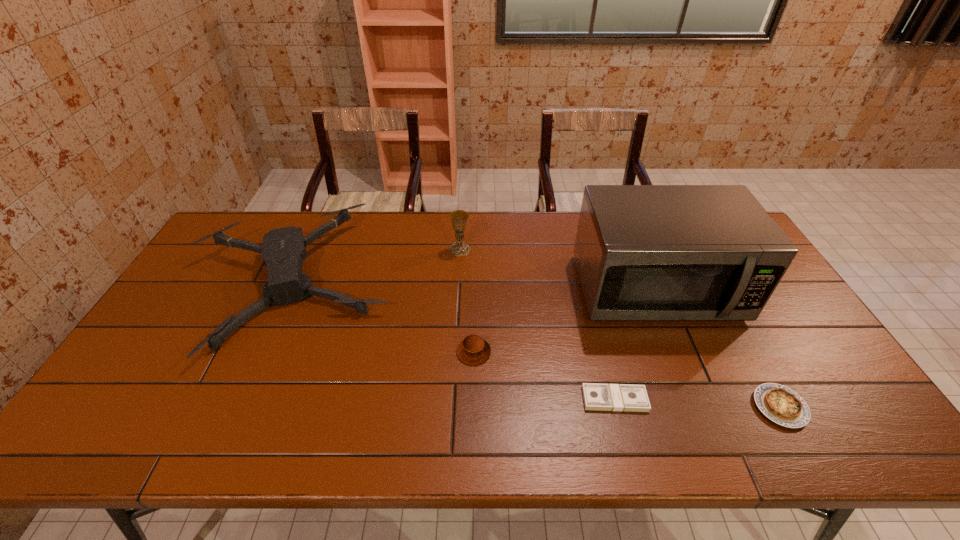
This screenshot has width=960, height=540. What are the coordinates of `vacant space located on the front of the fourth tallest object` in the screenshot? It's located at (473, 389).

Locate an element on the screen. The image size is (960, 540). vacant area situated on the back of the fifth tallest object is located at coordinates (742, 338).

The height and width of the screenshot is (540, 960). What are the coordinates of `free space located 0.190m on the left of the dollar` in the screenshot? It's located at (504, 399).

In order to click on chalice present at the far edge in this screenshot , I will do click(x=459, y=218).

Where is `drone that is at the far edge`? drone that is at the far edge is located at coordinates (283, 250).

Locate an element on the screen. The height and width of the screenshot is (540, 960). object that is at the near edge is located at coordinates pos(779,403).

What are the coordinates of `object that is at the left edge` in the screenshot? It's located at (283, 250).

Locate an element on the screen. Image resolution: width=960 pixels, height=540 pixels. microwave oven positioned at the right edge is located at coordinates (643, 252).

Locate an element on the screen. The width and height of the screenshot is (960, 540). quiche located in the right edge section of the desktop is located at coordinates (779, 403).

At what (x,y) coordinates should I click in order to perform the action: click on object situated at the far left corner. Please return your answer as a coordinate pair (x, y). This screenshot has width=960, height=540. Looking at the image, I should click on (283, 250).